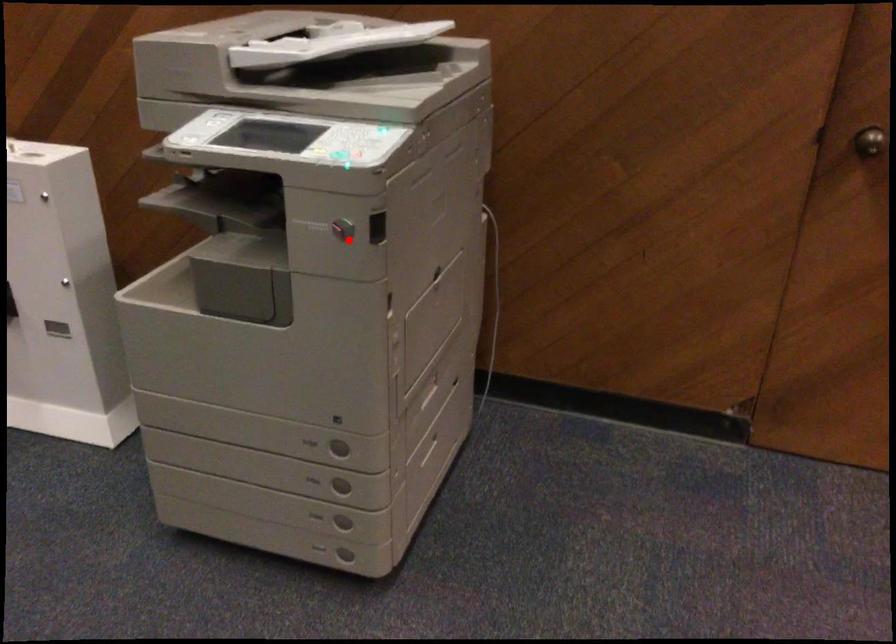
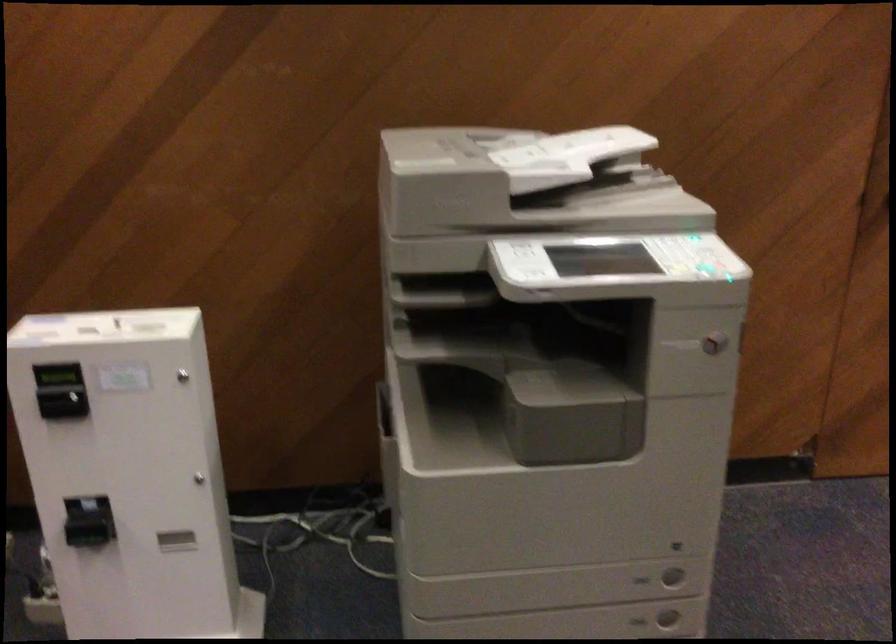
The point at the highlighted location is marked in the first image. Where is the corresponding point in the second image?

(713, 343)